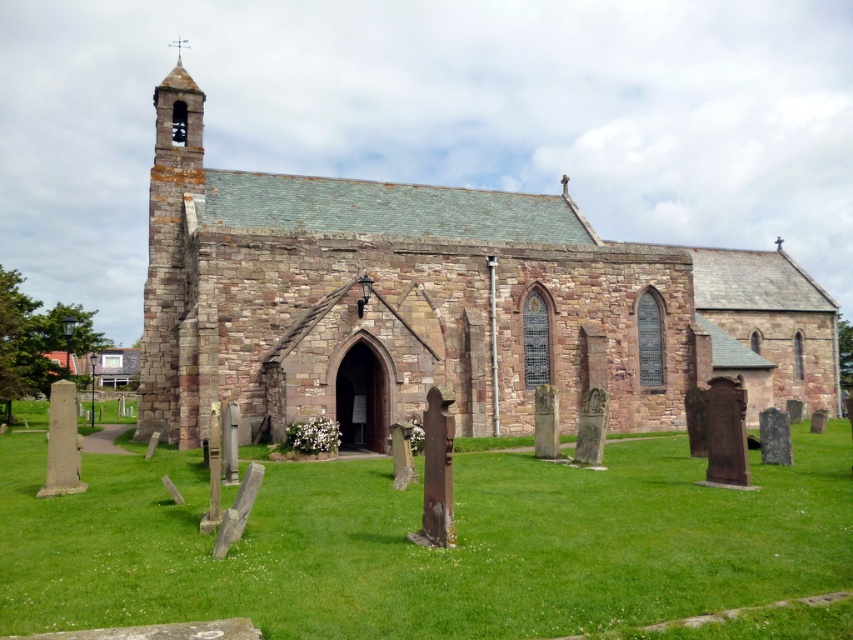
Which is more to the left, brown stone church at center or green grass at center?

From the viewer's perspective, green grass at center appears more on the left side.

Is brown stone church at center shorter than green grass at center?

Incorrect, brown stone church at center's height does not fall short of green grass at center's.

The height and width of the screenshot is (640, 853). In order to click on brown stone church at center in this screenshot , I will do `click(440, 305)`.